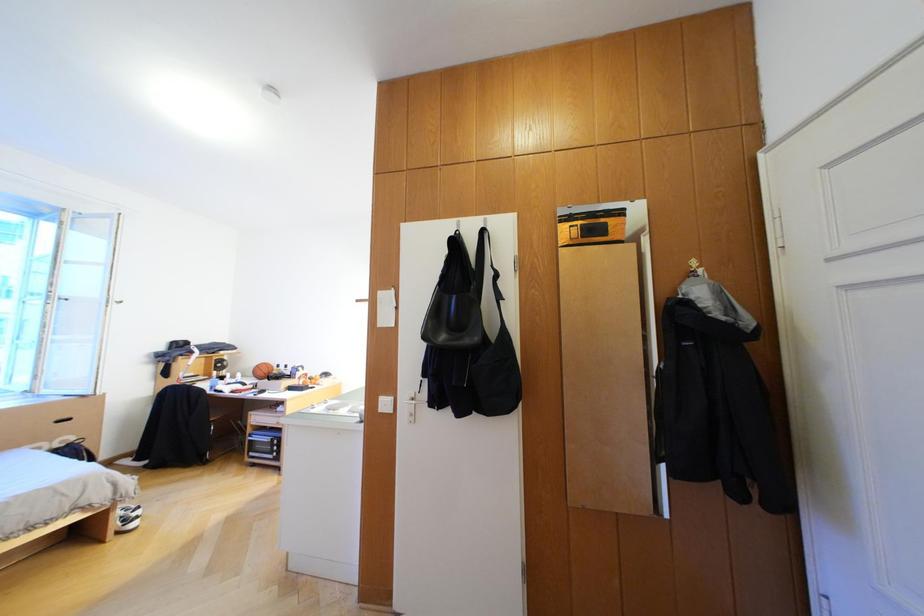
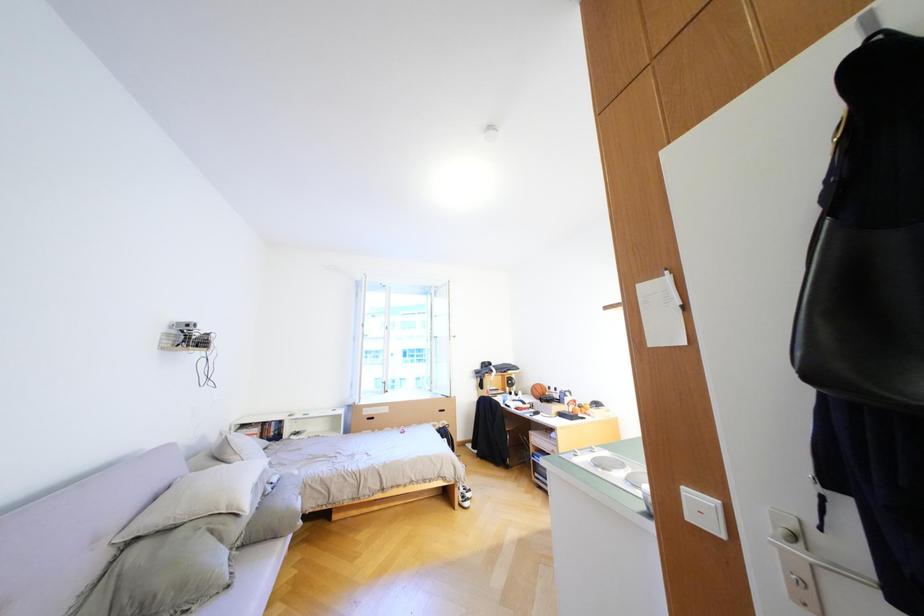
Question: The camera is either moving clockwise (left) or counter-clockwise (right) around the object. The first image is from the beginning of the video and the second image is from the end. Is the camera moving left or right when shooting the video?

Choices:
 (A) Left
 (B) Right

Answer: (B)